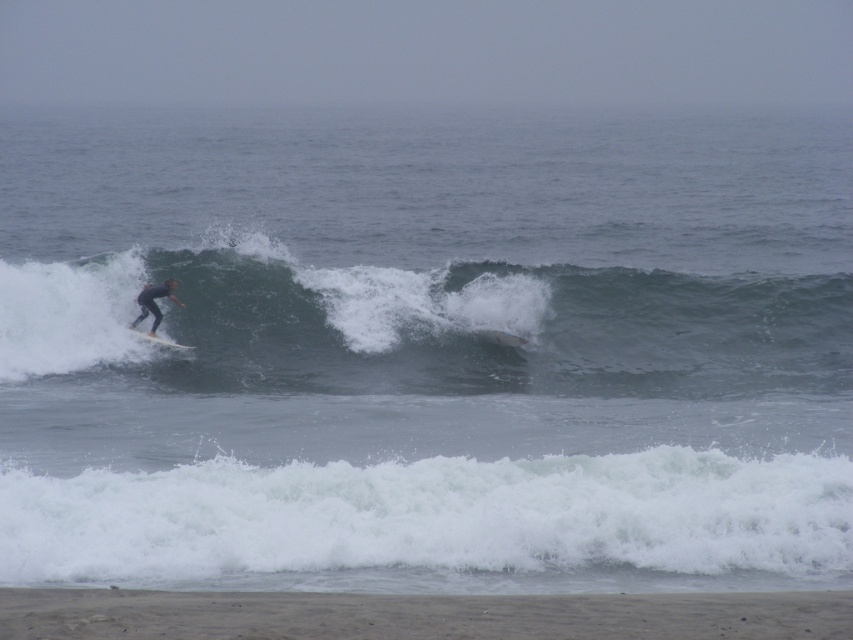
Question: Is smooth gray wave at center bigger than dark blue wetsuit at center?

Choices:
 (A) yes
 (B) no

Answer: (A)

Question: Which point is farther from the camera taking this photo?

Choices:
 (A) (155, 304)
 (B) (136, 330)
 (C) (418, 356)

Answer: (A)

Question: Does white foamy wave at lower center appear on the left side of white matte surfboard at left?

Choices:
 (A) no
 (B) yes

Answer: (A)

Question: Observing the image, what is the correct spatial positioning of white foamy wave at lower center in reference to white matte surfboard at left?

Choices:
 (A) below
 (B) above

Answer: (A)

Question: Which of the following is the closest to the observer?

Choices:
 (A) dark blue wetsuit at center
 (B) white matte surfboard at left

Answer: (B)

Question: Which of these objects is positioned farthest from the dark blue wetsuit at center?

Choices:
 (A) white foamy wave at lower center
 (B) smooth gray wave at center

Answer: (A)